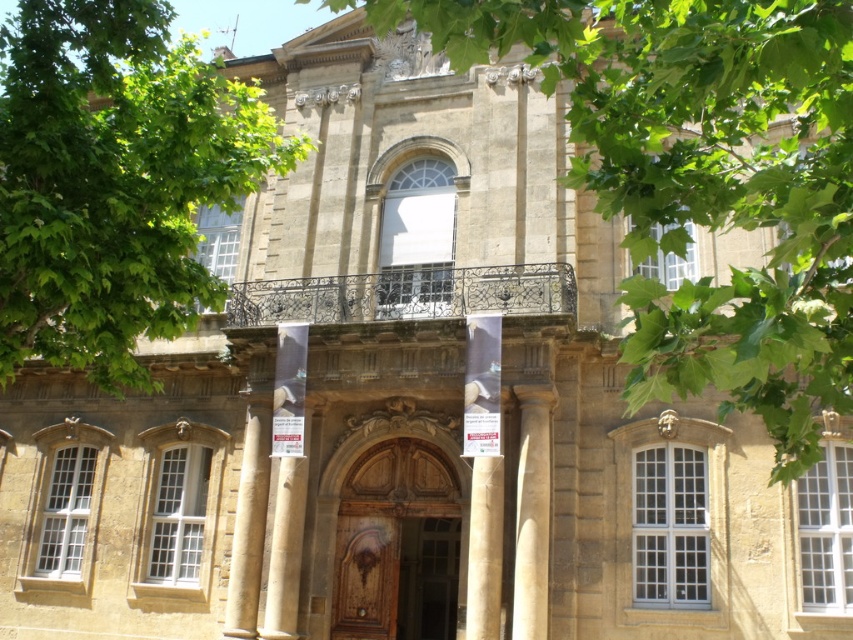
Question: Which object appears farthest from the camera in this image?

Choices:
 (A) wooden door at center
 (B) green leafy tree at center
 (C) beige stone column at center

Answer: (A)

Question: Which point is farther to the camera?

Choices:
 (A) (252, 557)
 (B) (689, 193)
 (C) (473, 472)
 (D) (426, 580)

Answer: (D)

Question: Does green leafy tree at center lie in front of smooth stone column at center?

Choices:
 (A) no
 (B) yes

Answer: (B)

Question: Is green leafy tree at center above green leafy tree at upper left?

Choices:
 (A) no
 (B) yes

Answer: (B)

Question: Which point is farther to the camera?

Choices:
 (A) green leafy tree at upper left
 (B) beige stone column at center

Answer: (B)

Question: Where is smooth stone column at center located in relation to beige stone column at center in the image?

Choices:
 (A) left
 (B) right

Answer: (B)